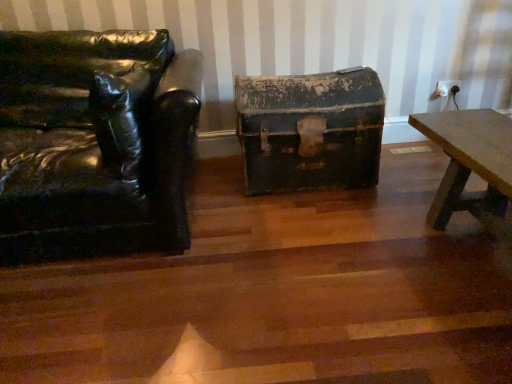
Question: Should I look upward or downward to see black leather chair at left?

Choices:
 (A) up
 (B) down

Answer: (A)

Question: Considering the relative sizes of rusty metal chest at center and black leather chair at left in the image provided, is rusty metal chest at center shorter than black leather chair at left?

Choices:
 (A) no
 (B) yes

Answer: (B)

Question: Are rusty metal chest at center and black leather chair at left far apart?

Choices:
 (A) no
 (B) yes

Answer: (A)

Question: Does rusty metal chest at center lie in front of black leather chair at left?

Choices:
 (A) yes
 (B) no

Answer: (B)

Question: Is rusty metal chest at center taller than black leather chair at left?

Choices:
 (A) no
 (B) yes

Answer: (A)

Question: Does rusty metal chest at center have a larger size compared to black leather chair at left?

Choices:
 (A) no
 (B) yes

Answer: (A)

Question: Considering the relative positions of rusty metal chest at center and black leather chair at left in the image provided, is rusty metal chest at center to the right of black leather chair at left from the viewer's perspective?

Choices:
 (A) yes
 (B) no

Answer: (A)

Question: From the image's perspective, is black leather chair at left on rusty metal chest at center?

Choices:
 (A) yes
 (B) no

Answer: (B)

Question: Can you confirm if black leather chair at left is thinner than rusty metal chest at center?

Choices:
 (A) no
 (B) yes

Answer: (A)

Question: Is black leather chair at left shorter than rusty metal chest at center?

Choices:
 (A) yes
 (B) no

Answer: (B)

Question: From a real-world perspective, is black leather chair at left over rusty metal chest at center?

Choices:
 (A) no
 (B) yes

Answer: (B)

Question: Considering the relative sizes of black leather chair at left and rusty metal chest at center in the image provided, is black leather chair at left wider than rusty metal chest at center?

Choices:
 (A) yes
 (B) no

Answer: (A)

Question: From a real-world perspective, is black leather chair at left under rusty metal chest at center?

Choices:
 (A) no
 (B) yes

Answer: (A)

Question: Looking at their shapes, would you say rusty metal chest at center is wider or thinner than black leather chair at left?

Choices:
 (A) wide
 (B) thin

Answer: (B)